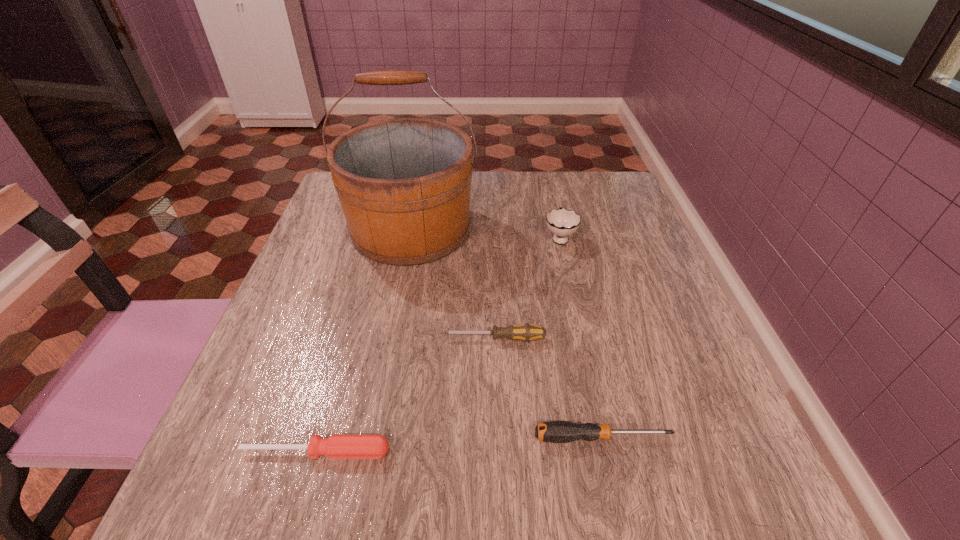
Image resolution: width=960 pixels, height=540 pixels. What are the coordinates of `free space located 0.220m at the tip of the third nearest object` in the screenshot? It's located at (324, 339).

You are a GUI agent. You are given a task and a screenshot of the screen. Output one action in this format:
    pyautogui.click(x=<x>, y=<y>)
    Task: Click on the vacant space located 0.250m on the back of the leftmost screwdriver
    
    Given the screenshot: What is the action you would take?
    pyautogui.click(x=354, y=319)

This screenshot has width=960, height=540. What are the coordinates of `object positioned at the far edge` in the screenshot? It's located at (404, 184).

Find the location of `bucket that is at the left edge`. bucket that is at the left edge is located at coordinates (404, 184).

In order to click on screwdriver present at the left edge in this screenshot , I will do `click(336, 446)`.

The image size is (960, 540). Identify the location of object at the right edge. (553, 431).

Where is `object that is positioned at the far left corner`? The height and width of the screenshot is (540, 960). object that is positioned at the far left corner is located at coordinates (404, 184).

The height and width of the screenshot is (540, 960). In order to click on vacant space at the far edge of the desktop in this screenshot , I will do `click(508, 187)`.

In the image, there is a desktop. Identify the location of free space at the near edge. This screenshot has width=960, height=540. point(368,526).

I want to click on vacant space at the left edge, so click(264, 368).